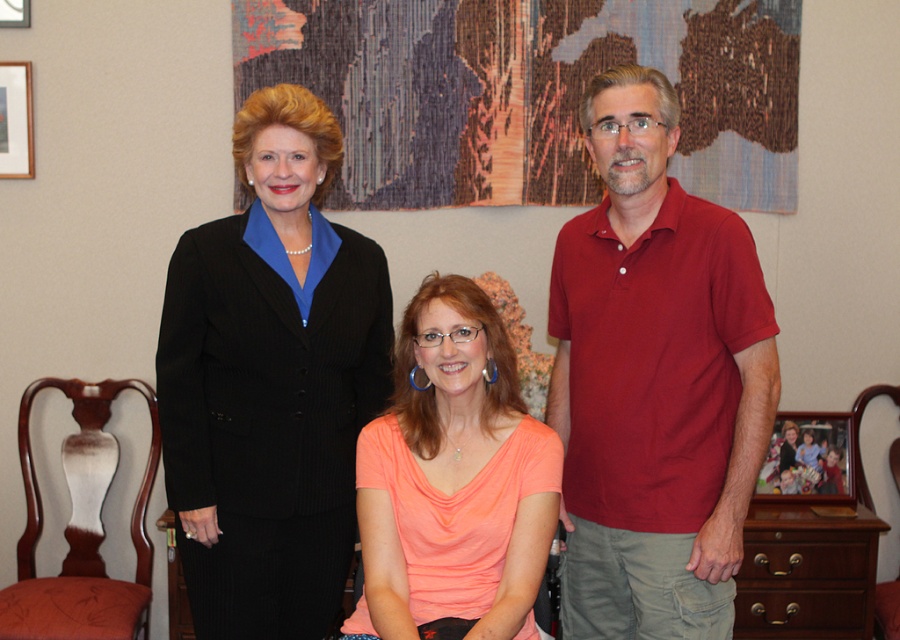
From the picture: You are taking a photo of two points in the image. The first point is at coordinates point (714,484) and the second point is at point (810,477). Which point is closer to you?

Point (714,484) is closer to the viewer than point (810,477).